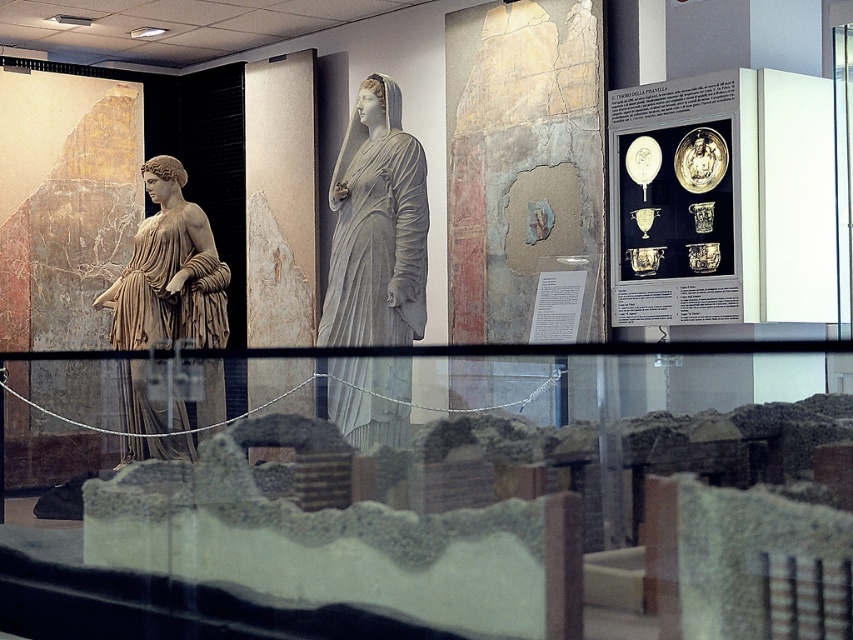
Who is positioned more to the right, gray stone statue at center or matte beige statue at left?

Positioned to the right is gray stone statue at center.

Between point (428, 220) and point (167, 196), which one is positioned behind?

Point (167, 196)

Which is in front, point (401, 275) or point (132, 292)?

Point (401, 275) is in front.

This screenshot has height=640, width=853. I want to click on gray stone statue at center, so click(376, 227).